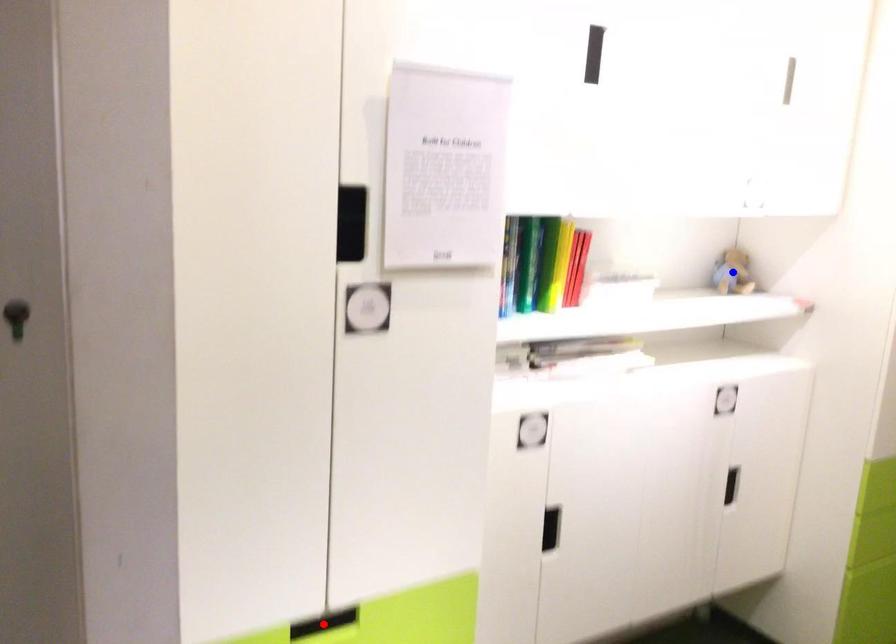
Question: Two points are marked on the image. Which point is closer to the camera?

Choices:
 (A) Blue point is closer.
 (B) Red point is closer.

Answer: (B)